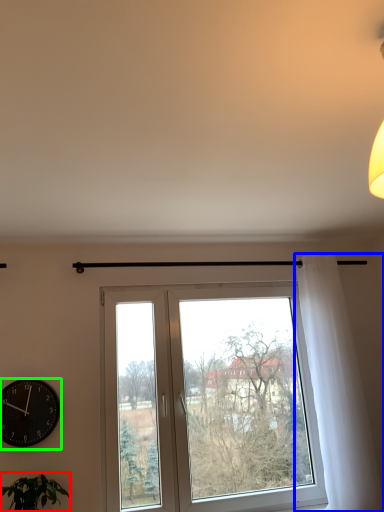
Question: Which is farther away from houseplant (highlighted by a red box)? curtain (highlighted by a blue box) or wall clock (highlighted by a green box)?

Choices:
 (A) curtain
 (B) wall clock

Answer: (A)